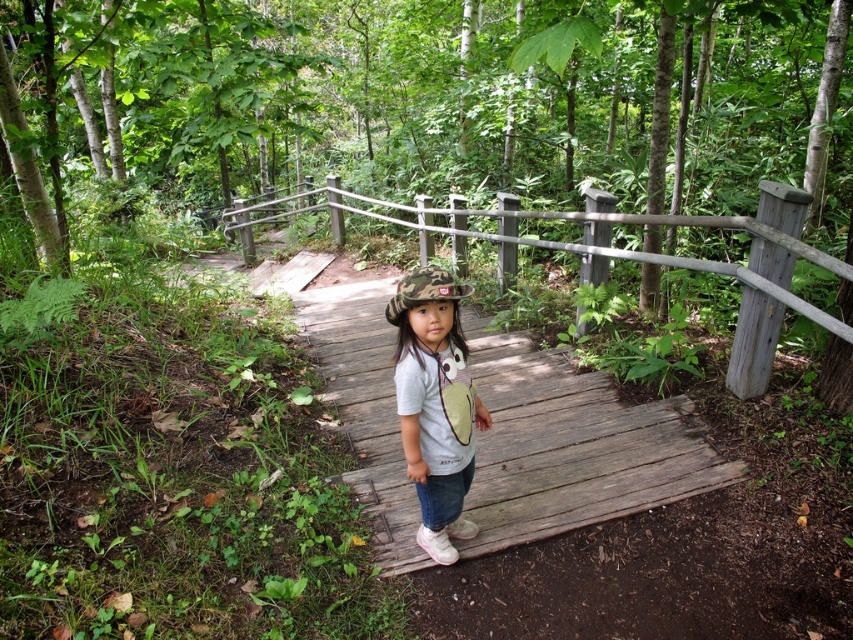
You are a photographer trying to capture the wooden at center and the camo fabric hat at center in the same frame. Based on their positions, which object should you adjust your camera to focus on first if you want to ensure both are in the frame?

The wooden at center is to the left of camo fabric hat at center, so you should focus on the wooden at center first to ensure both are in the frame.

You are a safety inspector checking the bridge. You notice the wooden at center and the camo fabric helmet at center. According to safety standards, the helmet must be placed above the wooden structure to prevent damage. Is the current placement compliant?

The wooden at center is positioned under the camo fabric helmet at center, so the placement is compliant with safety standards as the helmet is above the wooden structure.

Looking at this image, you are a parent trying to ensure your child stays safe on the wooden bridge. The wooden at center and the camo fabric helmet at center are both in the center of the bridge. How far apart are these two items?

The wooden at center is 1.72 meters away from the camo fabric helmet at center, so the distance between them is 1.72 meters.